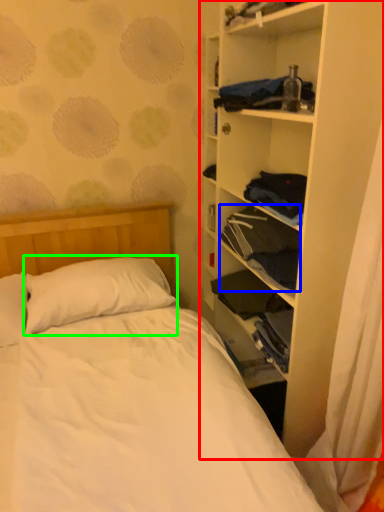
Question: Considering the real-world distances, which object is farthest from shelf (highlighted by a red box)? clothing (highlighted by a blue box) or pillow (highlighted by a green box)?

Choices:
 (A) clothing
 (B) pillow

Answer: (B)